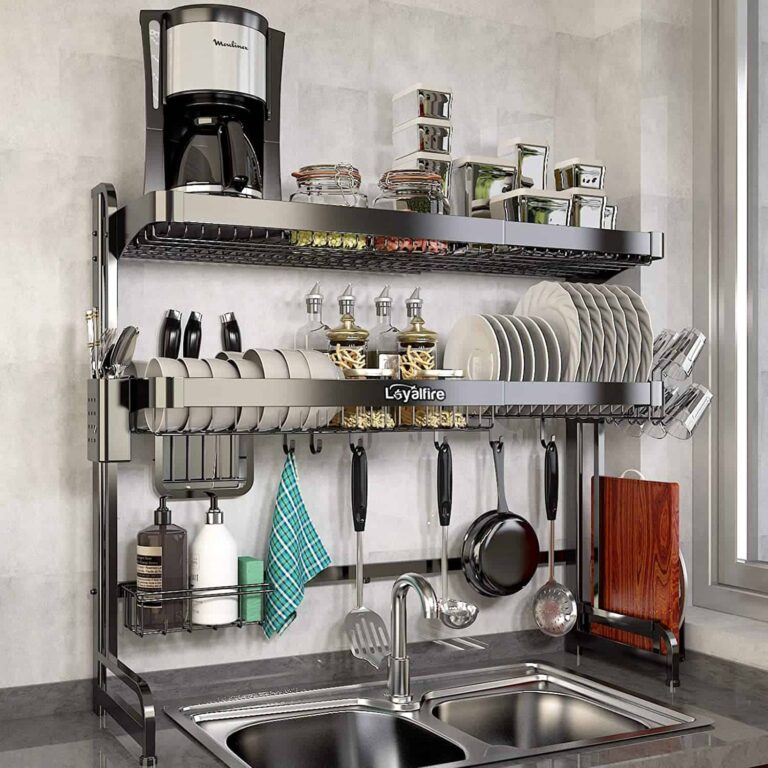
Where is `cup`? The width and height of the screenshot is (768, 768). cup is located at coordinates (682, 353), (659, 346), (692, 429), (651, 435), (631, 429).